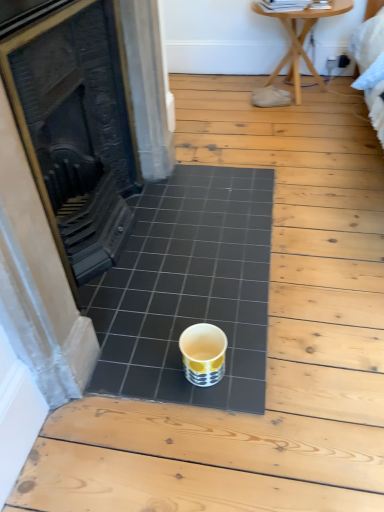
The width and height of the screenshot is (384, 512). I want to click on free space to the back side of yellow and white ceramic cup at center, so click(x=195, y=317).